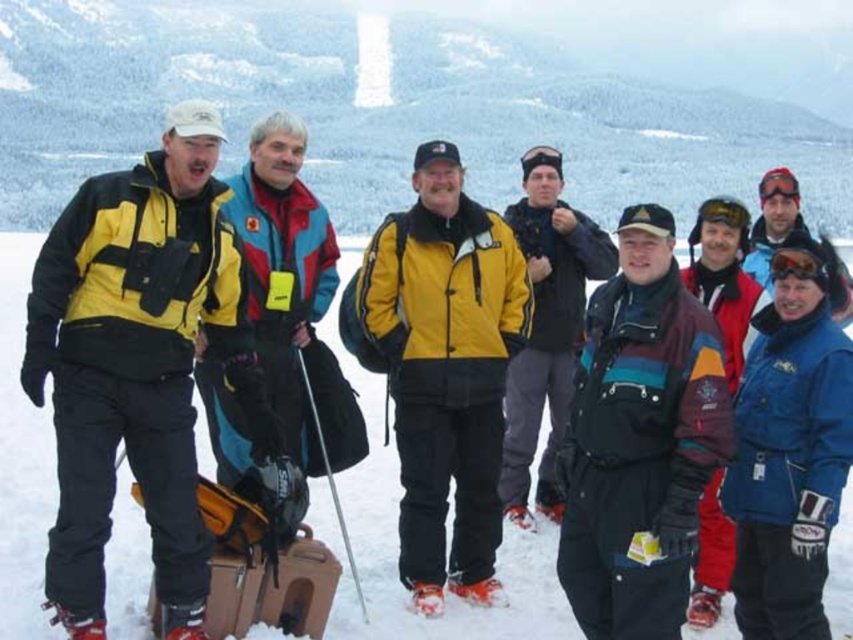
Question: Is multicolored fleece jacket at center closer to the viewer compared to blue fleece jacket at upper right?

Choices:
 (A) yes
 (B) no

Answer: (A)

Question: Which of the following is the farthest from the observer?

Choices:
 (A) (392, 348)
 (B) (165, 186)

Answer: (A)

Question: Which of these objects is positioned closest to the blue fleece jacket at upper right?

Choices:
 (A) matte black jacket at center
 (B) yellow matte jacket at center
 (C) yellow matte jacket at left

Answer: (A)

Question: Can you confirm if matte black jacket at center is bigger than blue fleece jacket at upper right?

Choices:
 (A) no
 (B) yes

Answer: (A)

Question: In this image, where is yellow matte jacket at left located relative to yellow matte jacket at center?

Choices:
 (A) below
 (B) above

Answer: (B)

Question: Based on their relative distances, which object is nearer to the multicolored fleece jacket at center?

Choices:
 (A) yellow matte jacket at left
 (B) white fluffy snow at center
 (C) blue fleece jacket at upper right
 (D) yellow matte jacket at center

Answer: (D)